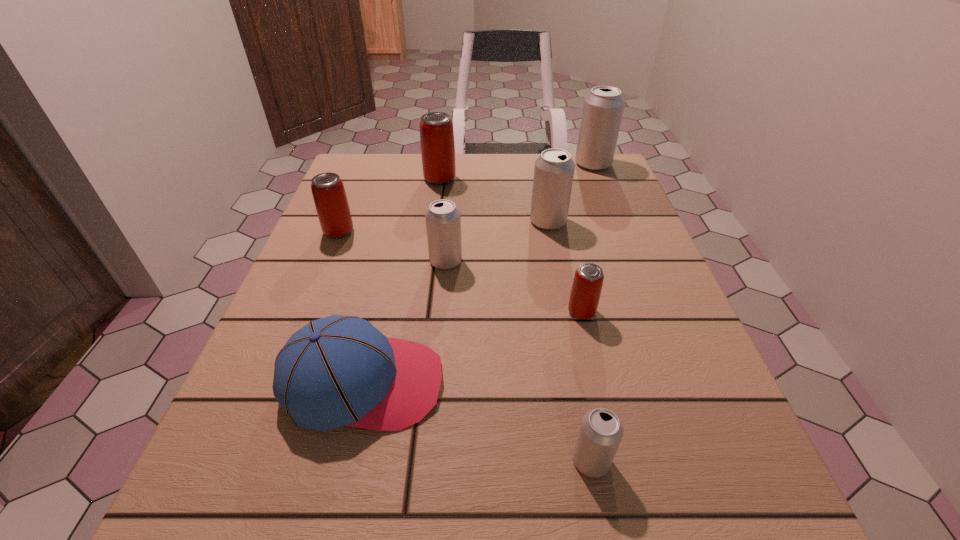
This screenshot has width=960, height=540. Find the location of `the rightmost white beer can`. the rightmost white beer can is located at coordinates (603, 107).

Locate an element on the screen. Image resolution: width=960 pixels, height=540 pixels. the tallest object is located at coordinates (603, 107).

Locate an element on the screen. the second pink beer can from right to left is located at coordinates (436, 128).

Locate an element on the screen. the farthest pink beer can is located at coordinates (436, 128).

You are a GUI agent. You are given a task and a screenshot of the screen. Output one action in this format:
    pyautogui.click(x=<x>, y=<y>)
    Task: Click on the third nearest white beer can
    
    Given the screenshot: What is the action you would take?
    pyautogui.click(x=554, y=169)

You are a GUI agent. You are given a task and a screenshot of the screen. Output one action in this format:
    pyautogui.click(x=<x>, y=<y>)
    Task: Click on the leftmost pink beer can
    
    Given the screenshot: What is the action you would take?
    pyautogui.click(x=328, y=191)

This screenshot has width=960, height=540. What are the coordinates of `the second biggest pink beer can` in the screenshot? It's located at (328, 191).

The image size is (960, 540). I want to click on the fifth farthest object, so click(x=443, y=219).

Locate an element on the screen. The image size is (960, 540). the second smallest white beer can is located at coordinates (443, 219).

I want to click on blue baseball cap, so click(336, 371).